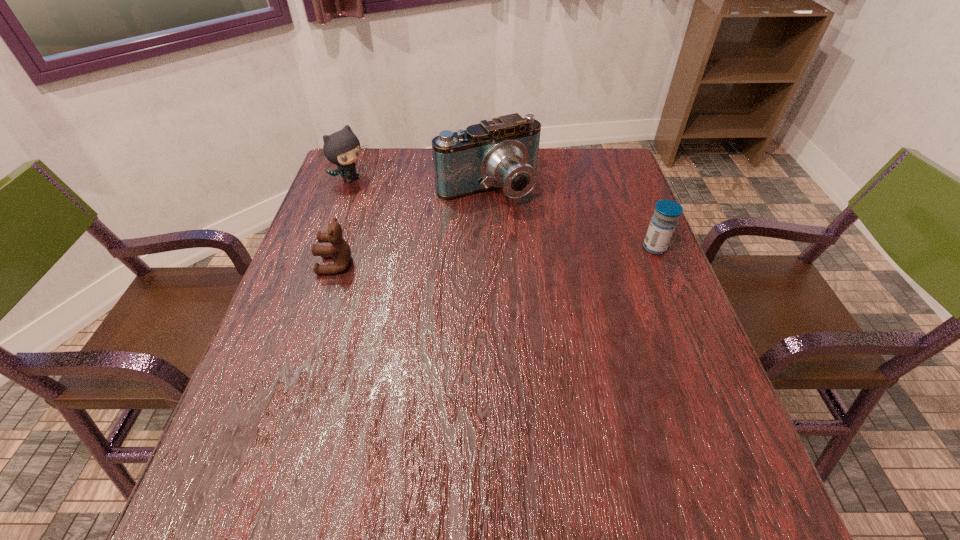
The width and height of the screenshot is (960, 540). In order to click on vacant area located on the front-facing side of the kitten in this screenshot , I will do `click(420, 221)`.

Find the location of a particular element. free location located 0.180m on the front-facing side of the kitten is located at coordinates (405, 212).

Locate an element on the screen. This screenshot has width=960, height=540. free space located 0.330m on the front-facing side of the kitten is located at coordinates (444, 234).

The image size is (960, 540). What are the coordinates of `camcorder that is at the far edge` in the screenshot? It's located at (502, 153).

This screenshot has height=540, width=960. Identify the location of kitten positioned at the far edge. (342, 148).

Image resolution: width=960 pixels, height=540 pixels. In order to click on teddy bear at the left edge in this screenshot , I will do `click(340, 251)`.

What are the coordinates of `kitten that is at the left edge` in the screenshot? It's located at (342, 148).

Find the location of a particular element. The image size is (960, 540). object that is at the right edge is located at coordinates (667, 212).

This screenshot has width=960, height=540. I want to click on object situated at the far left corner, so click(342, 148).

In the image, there is a desktop. Where is `free space at the far edge`? The image size is (960, 540). free space at the far edge is located at coordinates (414, 147).